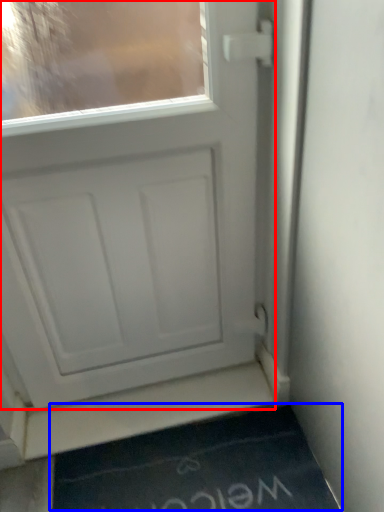
Question: Among these objects, which one is farthest to the camera, door (highlighted by a red box) or doormat (highlighted by a blue box)?

Choices:
 (A) door
 (B) doormat

Answer: (B)